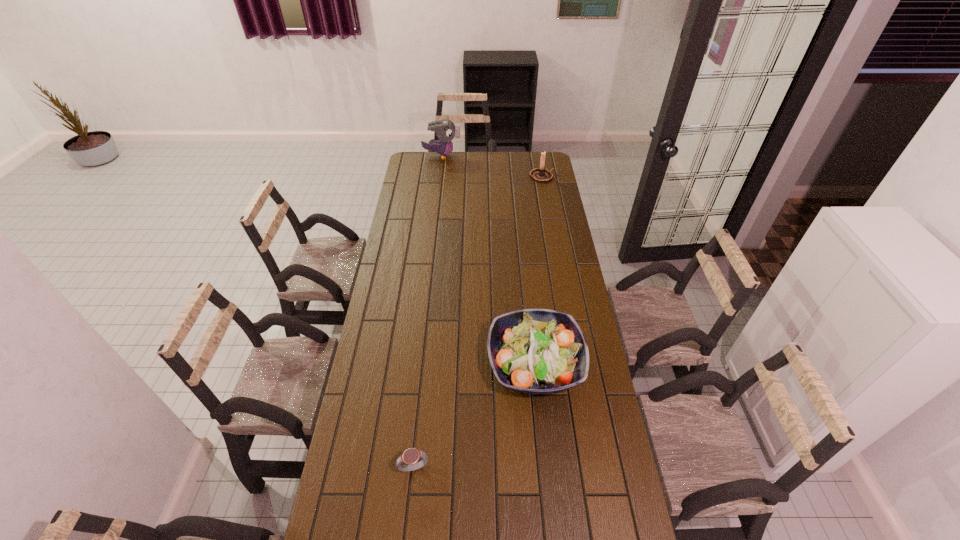
This screenshot has height=540, width=960. I want to click on free location at the left edge of the desktop, so click(385, 345).

In the image, there is a desktop. Find the location of `free space at the right edge`. free space at the right edge is located at coordinates coord(541,192).

Find the location of `vacant space at the far left corner`. vacant space at the far left corner is located at coordinates (414, 169).

Where is `vacant region at the far right corner of the desktop`? The image size is (960, 540). vacant region at the far right corner of the desktop is located at coordinates (525, 158).

Where is `free space between the bird and the watch`? This screenshot has height=540, width=960. free space between the bird and the watch is located at coordinates (427, 311).

I want to click on unoccupied position between the third nearest object and the third farthest object, so click(x=539, y=270).

This screenshot has width=960, height=540. I want to click on vacant space that's between the watch and the tallest object, so click(427, 311).

I want to click on vacant region between the shortest object and the third tallest object, so tap(474, 416).

Identify the location of free point between the third farthest object and the shortest object. The image size is (960, 540). (474, 416).

Identify the location of empty space between the nearest object and the second shortest object. (474, 416).